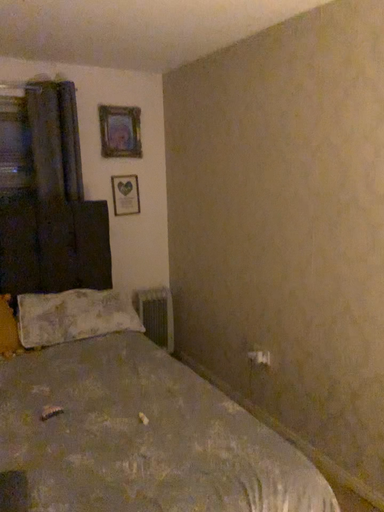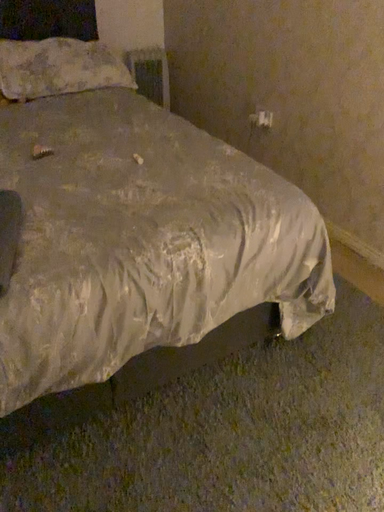
Question: Which way did the camera rotate in the video?

Choices:
 (A) rotated downward
 (B) rotated upward

Answer: (A)